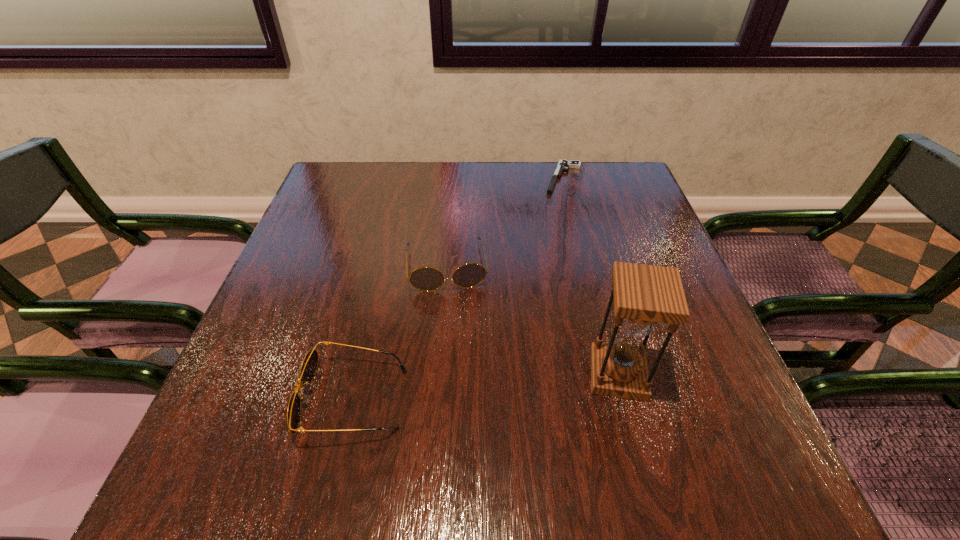
I want to click on vacant spot on the desktop that is between the shorter sunglasses and the tallest object and is positioned on the front-facing side of the farthest object, so click(x=492, y=386).

Identify the location of free space on the desktop that is between the third tallest object and the tallest object and is positioned on the lenses of the taller sunglasses. (460, 389).